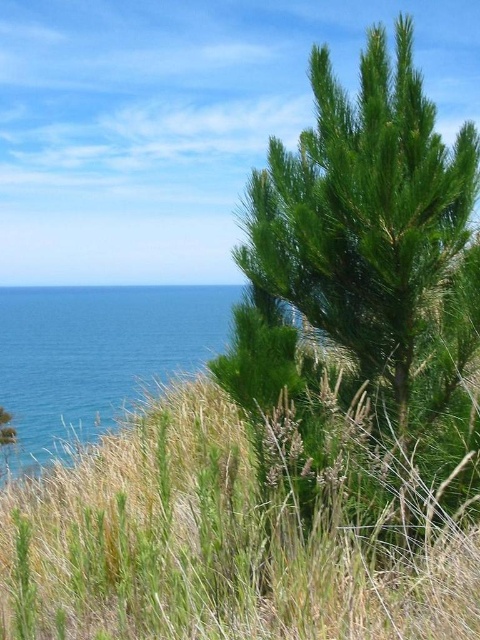
Between green needle-like at center and green grassy at center, which one is positioned lower?

green grassy at center is lower down.

Is green needle-like at center positioned in front of green grassy at center?

That is False.

Which is in front, point (312, 280) or point (34, 563)?

Point (312, 280) is more forward.

Image resolution: width=480 pixels, height=640 pixels. In order to click on green needle-like at center in this screenshot , I will do `click(363, 301)`.

Based on the photo, between green needle-like at center and blue liquid water at left, which one appears on the left side from the viewer's perspective?

Positioned to the left is blue liquid water at left.

Between green needle-like at center and blue liquid water at left, which one has more height?

Standing taller between the two is blue liquid water at left.

Measure the distance between green needle-like at center and camera.

They are 10.99 feet apart.

Where is `green needle-like at center`? Image resolution: width=480 pixels, height=640 pixels. green needle-like at center is located at coordinates (363, 301).

This screenshot has width=480, height=640. In order to click on green grassy at center in this screenshot , I will do (215, 547).

Is green grassy at center thinner than blue liquid water at left?

Yes, green grassy at center is thinner than blue liquid water at left.

Where is `green grassy at center`? The width and height of the screenshot is (480, 640). green grassy at center is located at coordinates (215, 547).

Find the location of a particular element. This screenshot has width=480, height=640. green grassy at center is located at coordinates (215, 547).